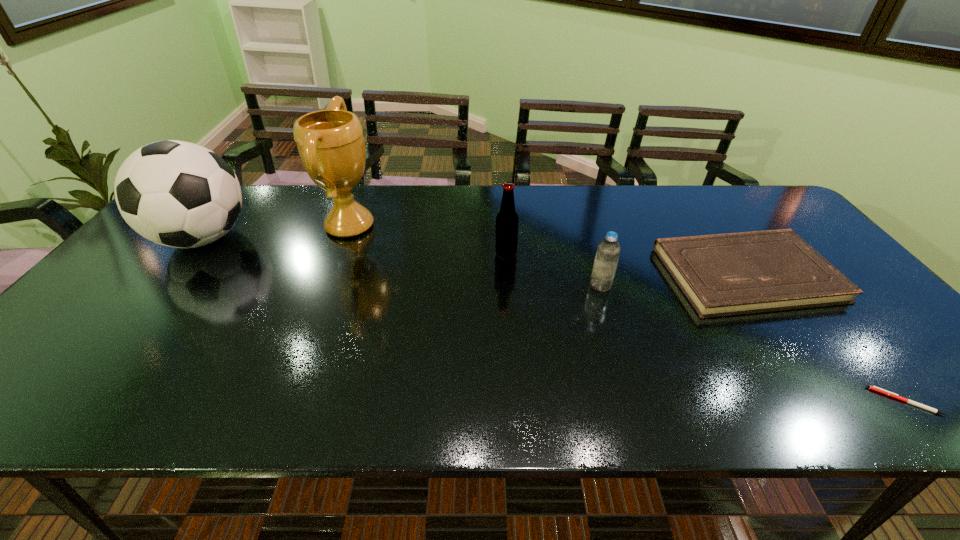
You are a GUI agent. You are given a task and a screenshot of the screen. Output one action in this format:
    pyautogui.click(x=<x>, y=<y>)
    Task: Click on the soccer ball situated at the far edge
    
    Given the screenshot: What is the action you would take?
    pyautogui.click(x=178, y=194)

In order to click on object that is positioned at the near edge in this screenshot , I will do `click(874, 388)`.

Where is `object at the left edge`? Image resolution: width=960 pixels, height=540 pixels. object at the left edge is located at coordinates click(x=178, y=194).

The width and height of the screenshot is (960, 540). Find the location of `paperback book located at the right edge`. paperback book located at the right edge is located at coordinates (727, 274).

Find the location of a particular element. The height and width of the screenshot is (540, 960). pen at the right edge is located at coordinates (874, 388).

Find the location of a particular element. Image resolution: width=960 pixels, height=540 pixels. object that is at the far left corner is located at coordinates (178, 194).

The width and height of the screenshot is (960, 540). In order to click on object located at the near right corner in this screenshot , I will do `click(874, 388)`.

Locate an element on the screen. This screenshot has height=540, width=960. free spot at the far edge of the desktop is located at coordinates (314, 217).

The height and width of the screenshot is (540, 960). Identify the location of free location at the left edge of the desktop. (149, 261).

Identify the location of free space at the right edge. (846, 333).